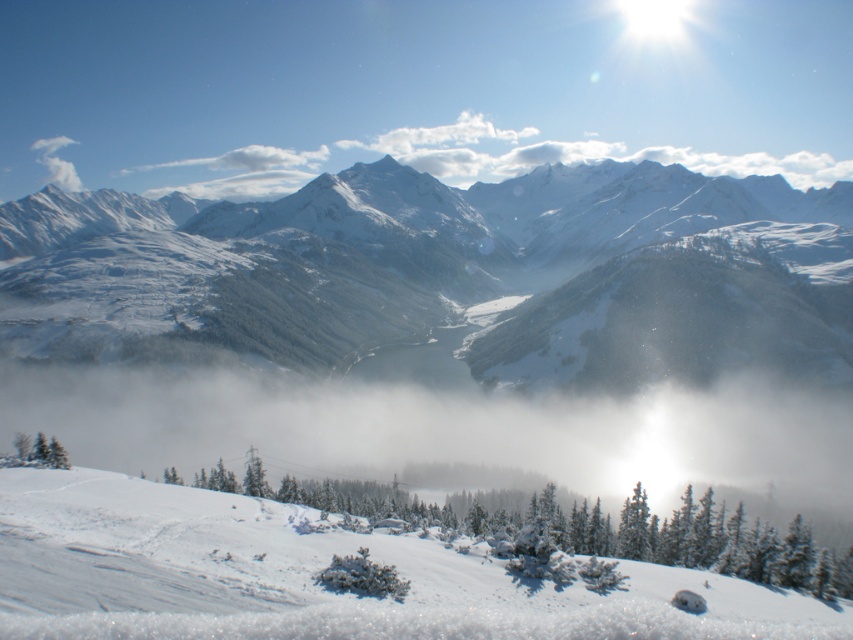
Which is behind, point (231, 314) or point (67, 180)?

The point (67, 180) is more distant.

Between white snow-covered mountain range at upper center and white fluffy cloud at upper left, which one has less height?

white fluffy cloud at upper left is shorter.

Is point (700, 192) behind point (73, 170)?

No, (700, 192) is closer to viewer.

Image resolution: width=853 pixels, height=640 pixels. In order to click on white snow-covered mountain range at upper center in this screenshot , I will do `click(451, 275)`.

Is white snow-covered mountain range at upper center thinner than white snow ski slope at lower left?

No.

Who is positioned more to the left, white snow-covered mountain range at upper center or white snow ski slope at lower left?

white snow-covered mountain range at upper center is more to the left.

This screenshot has height=640, width=853. I want to click on white snow-covered mountain range at upper center, so click(x=451, y=275).

Between point (100, 484) and point (39, 138), which one is positioned behind?

Point (39, 138)

Is point (183, 520) positioned after point (47, 150)?

No, (183, 520) is in front of (47, 150).

Where is `white snow ski slope at lower left`? The height and width of the screenshot is (640, 853). white snow ski slope at lower left is located at coordinates [x=314, y=576].